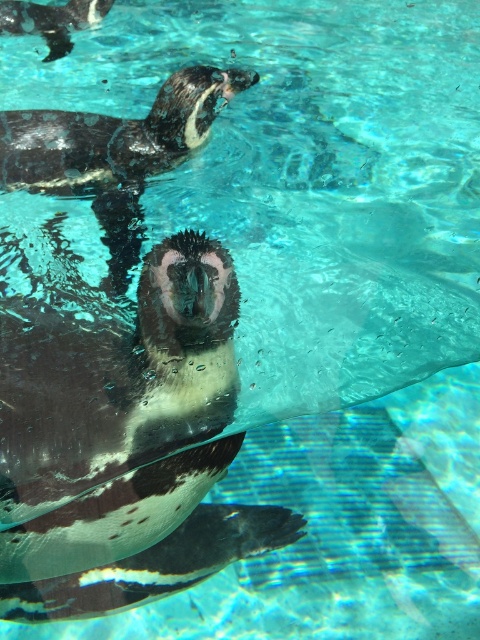
Between black glossy penguin at center and black glossy penguin at upper left, which one appears on the right side from the viewer's perspective?

Positioned to the right is black glossy penguin at center.

Measure the distance from black glossy penguin at center to black glossy penguin at upper left.

black glossy penguin at center and black glossy penguin at upper left are 1.73 meters apart.

Is point (43, 397) closer to camera compared to point (36, 6)?

Yes, it is in front of point (36, 6).

You are a GUI agent. You are given a task and a screenshot of the screen. Output one action in this format:
    pyautogui.click(x=<x>, y=<y>)
    Task: Click on the black glossy penguin at center
    Image resolution: width=480 pixels, height=640 pixels.
    Given the screenshot: What is the action you would take?
    pyautogui.click(x=124, y=445)

Does point (142, 435) come farther from viewer compared to point (111, 230)?

No, it is not.

Between black glossy penguin at center and black glossy penguin at upper center, which one has more height?

Standing taller between the two is black glossy penguin at center.

Is point (7, 394) closer to camera compared to point (195, 84)?

Yes, it is in front of point (195, 84).

What are the coordinates of `black glossy penguin at center` in the screenshot? It's located at (124, 445).

Between black glossy penguin at upper center and black glossy penguin at upper left, which one appears on the left side from the viewer's perspective?

From the viewer's perspective, black glossy penguin at upper left appears more on the left side.

Is black glossy penguin at upper center above black glossy penguin at upper left?

No.

Who is more distant from viewer, [171,138] or [12,28]?

Positioned behind is point [12,28].

Where is `black glossy penguin at upper center`? Image resolution: width=480 pixels, height=640 pixels. black glossy penguin at upper center is located at coordinates (116, 152).